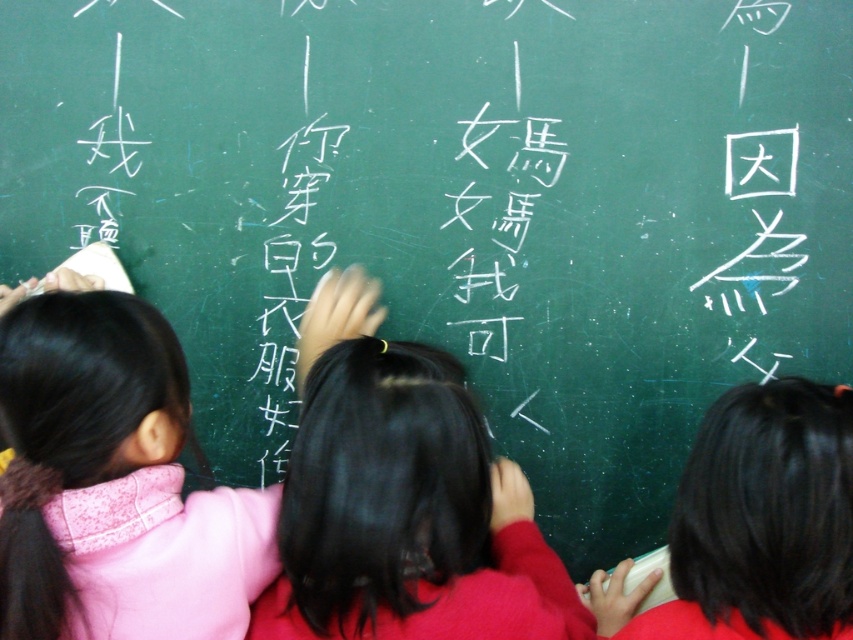
You are a teacher observing the children writing on the chalkboard. You notice the pink fabric at left and the black hair at right. Which object is positioned higher on the chalkboard?

The pink fabric at left is above black hair at right, so the pink fabric at left is positioned higher on the chalkboard.

You are standing in front of the chalkboard where three children are writing Chinese characters. There are two points marked on the board at coordinates point (175,550) and point (795,452). If you want to erase the point that is closer to you, which one should you choose?

Point (175,550) is further to the viewer than point (795,452), so the closer point to erase is point (795,452).